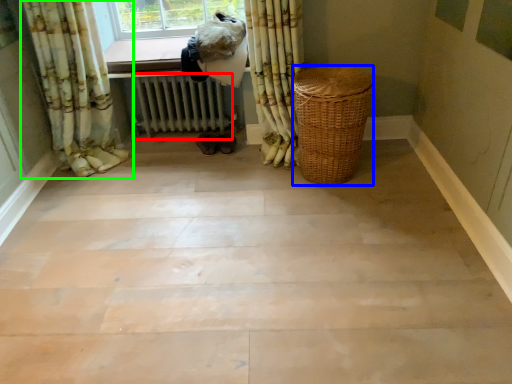
Question: Which is farther away from radiator (highlighted by a red box)? basket (highlighted by a blue box) or curtain (highlighted by a green box)?

Choices:
 (A) basket
 (B) curtain

Answer: (A)